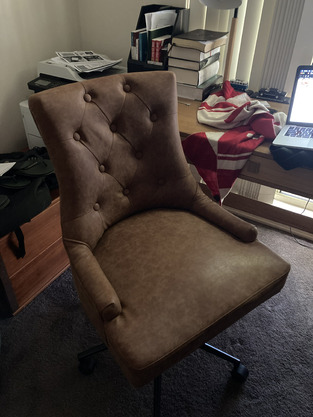
You are a GUI agent. You are given a task and a screenshot of the screen. Output one action in this format:
    pyautogui.click(x=<x>, y=<y>)
    Task: Click on the laptop screen
    The width and height of the screenshot is (313, 417).
    Given the screenshot: What is the action you would take?
    pyautogui.click(x=303, y=102)